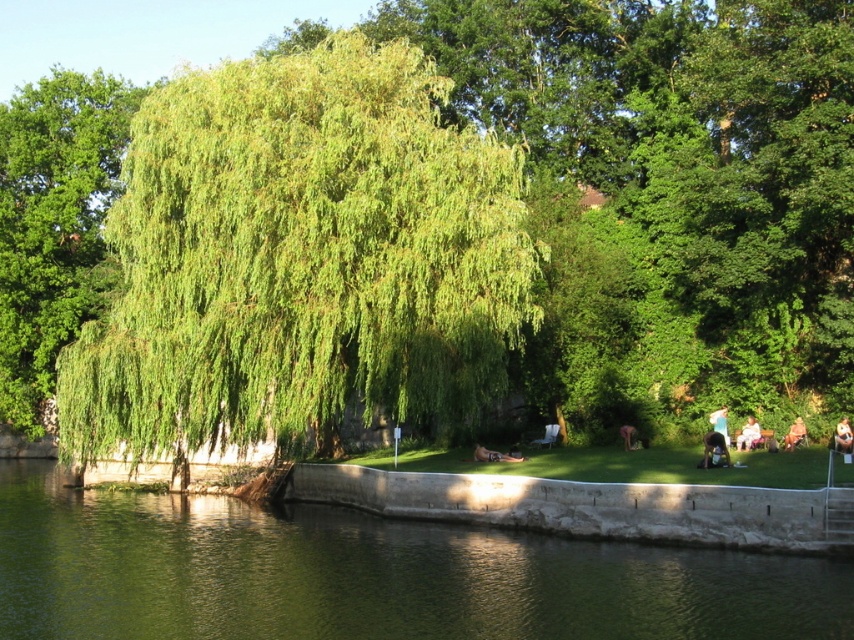
Question: Which of these objects is positioned closest to the green smooth water at lower left?

Choices:
 (A) pink fabric chair at right
 (B) light blue shirt at center

Answer: (A)

Question: Is matte black person at center below pink fabric person at lower right?

Choices:
 (A) yes
 (B) no

Answer: (A)

Question: Does green leafy tree at left have a larger size compared to light brown fabric bag at lower right?

Choices:
 (A) no
 (B) yes

Answer: (B)

Question: Observing the image, what is the correct spatial positioning of pink fabric chair at right in reference to brown leather jacket at lower right?

Choices:
 (A) right
 (B) left

Answer: (B)

Question: Which point appears farthest from the camera in this image?

Choices:
 (A) (784, 436)
 (B) (753, 440)
 (C) (718, 424)
 (D) (299, 540)

Answer: (C)

Question: Among these points, which one is nearest to the camera?

Choices:
 (A) (741, 577)
 (B) (711, 412)

Answer: (A)